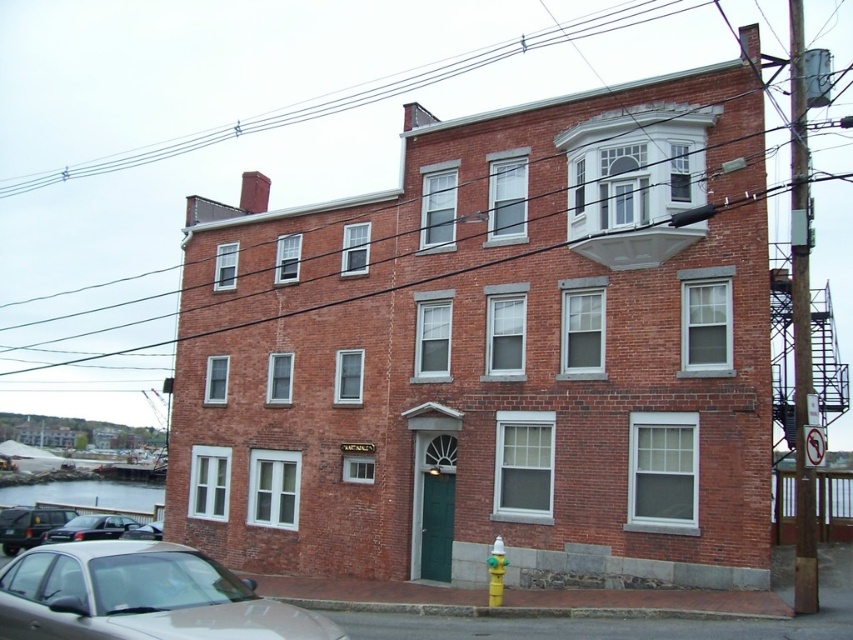
Does shiny black car at lower left come in front of black glossy car at lower left?

No, shiny black car at lower left is further to the viewer.

Who is more forward, (16, 506) or (97, 531)?

Point (97, 531) is more forward.

You are a GUI agent. You are given a task and a screenshot of the screen. Output one action in this format:
    pyautogui.click(x=<x>, y=<y>)
    Task: Click on the shiny black car at lower left
    
    Given the screenshot: What is the action you would take?
    pyautogui.click(x=28, y=525)

Based on the photo, can you confirm if shiny black car at lower left is shorter than yellow matte hydrant at lower right?

Incorrect, shiny black car at lower left's height does not fall short of yellow matte hydrant at lower right's.

You are a GUI agent. You are given a task and a screenshot of the screen. Output one action in this format:
    pyautogui.click(x=<x>, y=<y>)
    Task: Click on the shiny black car at lower left
    Image resolution: width=853 pixels, height=640 pixels.
    Given the screenshot: What is the action you would take?
    pyautogui.click(x=28, y=525)

You are a GUI agent. You are given a task and a screenshot of the screen. Output one action in this format:
    pyautogui.click(x=<x>, y=<y>)
    Task: Click on the shiny black car at lower left
    This screenshot has width=853, height=640.
    Given the screenshot: What is the action you would take?
    pyautogui.click(x=28, y=525)

From the picture: Does silver metallic car at lower left appear on the right side of black glossy car at lower left?

Indeed, silver metallic car at lower left is positioned on the right side of black glossy car at lower left.

Describe the element at coordinates (140, 596) in the screenshot. I see `silver metallic car at lower left` at that location.

Locate an element on the screen. silver metallic car at lower left is located at coordinates (140, 596).